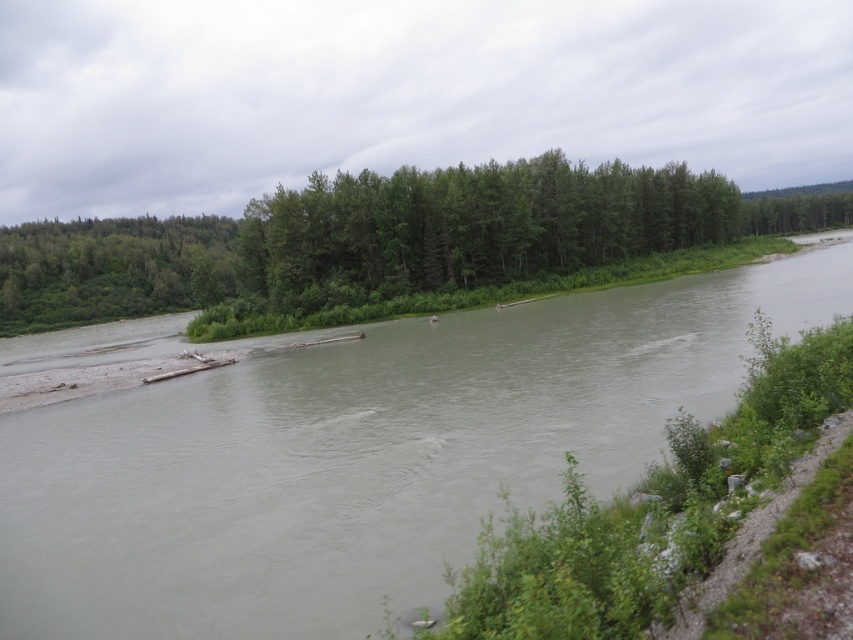
You are a kayaker planning to navigate the river shown in the image. You notice the brown muddy water at center and the green matte forest at center. Which of these two features is narrower in width?

The brown muddy water at center is thinner than the green matte forest at center, so the brown muddy water at center is narrower in width.

You are a hiker who wants to cross the river using a fallen tree trunk as a bridge. You see the brown muddy water at center and the green matte forest at center. Which object is closer to the ground?

The brown muddy water at center is located below green matte forest at center, so the brown muddy water at center is closer to the ground.

You are a hiker who wants to cross the river using a bridge that is 80 feet long. You see the brown muddy water at center and the green matte forest at center. Can you safely cross the river with the bridge between them?

The brown muddy water at center and the green matte forest at center are 88.13 feet apart. The bridge is only 80 feet long, so it would not span the entire distance. Therefore, you cannot safely cross the river with the bridge between them.